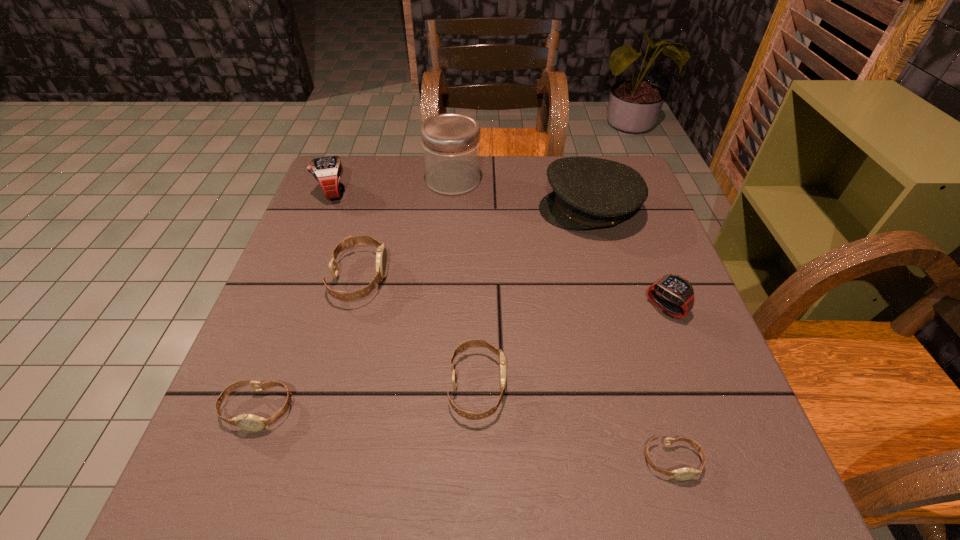
Where is `free space located 0.110m on the front of the smaller red watch`? The image size is (960, 540). free space located 0.110m on the front of the smaller red watch is located at coordinates (689, 370).

Identify the location of free space located 0.220m on the face of the third shortest watch. (626, 386).

Identify the location of jar that is at the far edge. The width and height of the screenshot is (960, 540). (450, 142).

The width and height of the screenshot is (960, 540). Identify the location of beret situated at the far edge. [588, 192].

Locate an element on the screen. The image size is (960, 540). watch that is at the far edge is located at coordinates (327, 171).

Image resolution: width=960 pixels, height=540 pixels. What are the coordinates of `object positioned at the near edge` in the screenshot? It's located at (687, 473).

At what (x,y) coordinates should I click in order to perform the action: click on beret that is positioned at the right edge. Please return your answer as a coordinate pair (x, y). Looking at the image, I should click on (588, 192).

Find the location of a particular element. object at the far left corner is located at coordinates pyautogui.click(x=327, y=171).

Locate an element on the screen. Image resolution: width=960 pixels, height=540 pixels. object present at the far right corner is located at coordinates (588, 192).

You are a GUI agent. You are given a task and a screenshot of the screen. Output one action in this format:
    pyautogui.click(x=<x>, y=<y>)
    Task: Click on the object that is at the near right corner
    
    Given the screenshot: What is the action you would take?
    pyautogui.click(x=687, y=473)